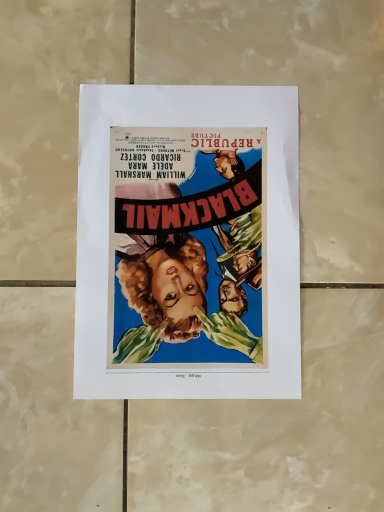
What do you see at coordinates (187, 243) in the screenshot? Image resolution: width=384 pixels, height=512 pixels. I see `vibrant paper poster at center` at bounding box center [187, 243].

I want to click on vibrant paper poster at center, so click(x=187, y=243).

Locate an element on the screen. The height and width of the screenshot is (512, 384). vibrant paper poster at center is located at coordinates (187, 243).